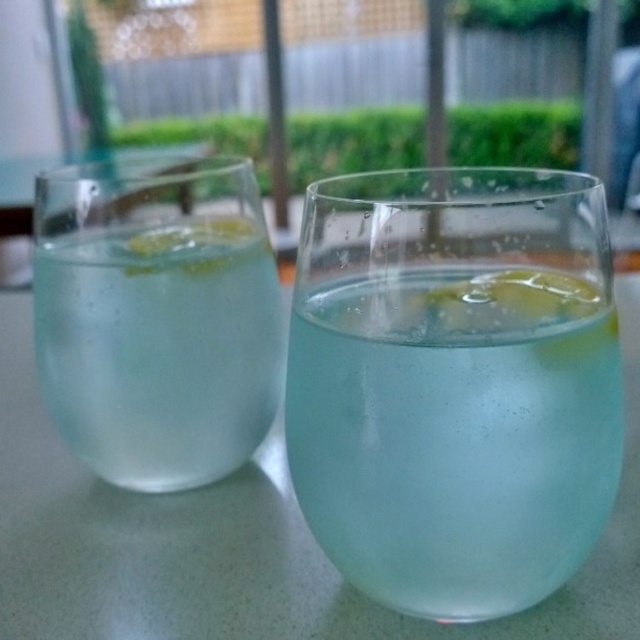
Question: Which object is the farthest from the transparent glass at center?

Choices:
 (A) clear glass at left
 (B) clear glass at center

Answer: (B)

Question: In this image, where is clear glass at center located relative to clear glass at left?

Choices:
 (A) below
 (B) above

Answer: (B)

Question: Among these points, which one is farthest from the camera?

Choices:
 (A) (403, 435)
 (B) (148, 509)

Answer: (B)

Question: Among these points, which one is farthest from the camera?

Choices:
 (A) (625, 518)
 (B) (160, 275)
 (C) (321, 262)

Answer: (B)

Question: Can you confirm if clear glass at center is thinner than clear glass at left?

Choices:
 (A) no
 (B) yes

Answer: (A)

Question: Can you confirm if transparent glass at center is positioned above clear glass at left?

Choices:
 (A) yes
 (B) no

Answer: (A)